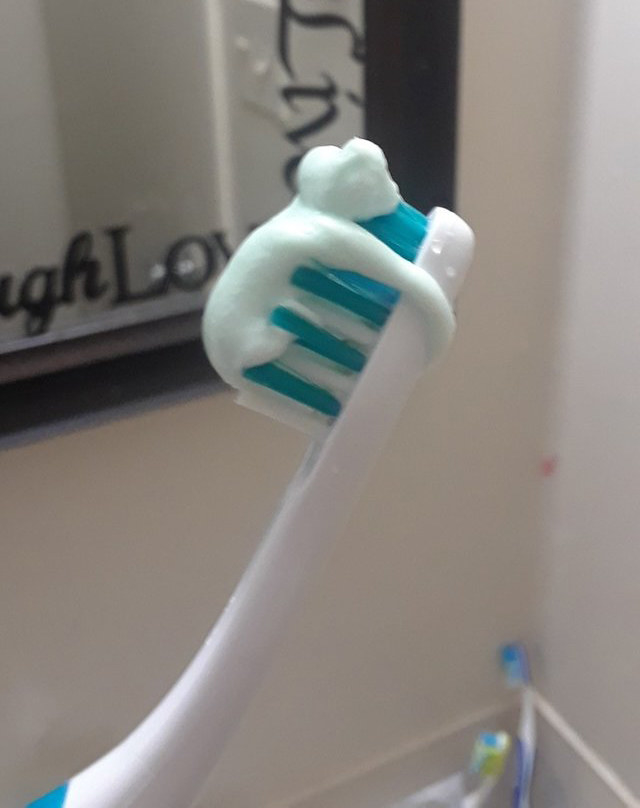
This screenshot has width=640, height=808. Identify the location of door. (180, 43).